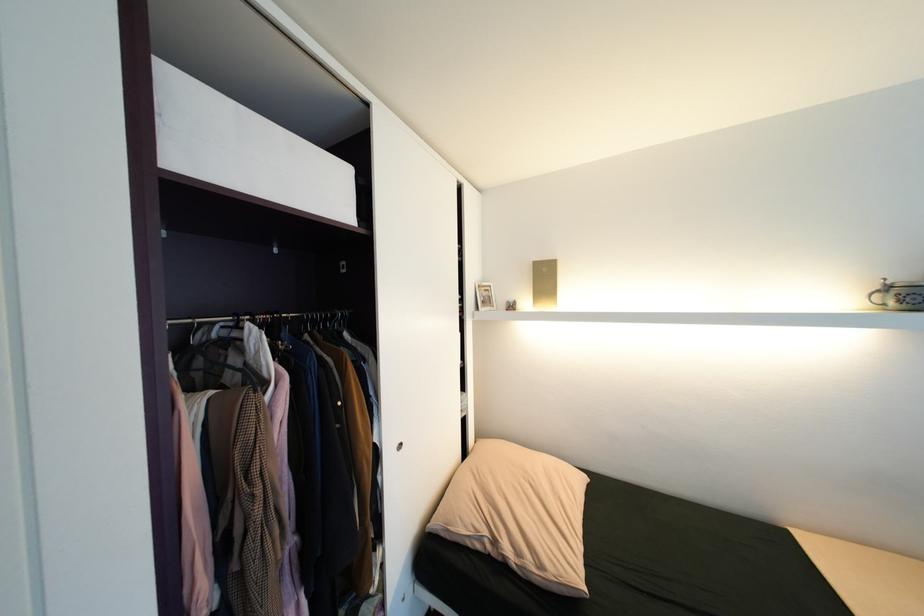
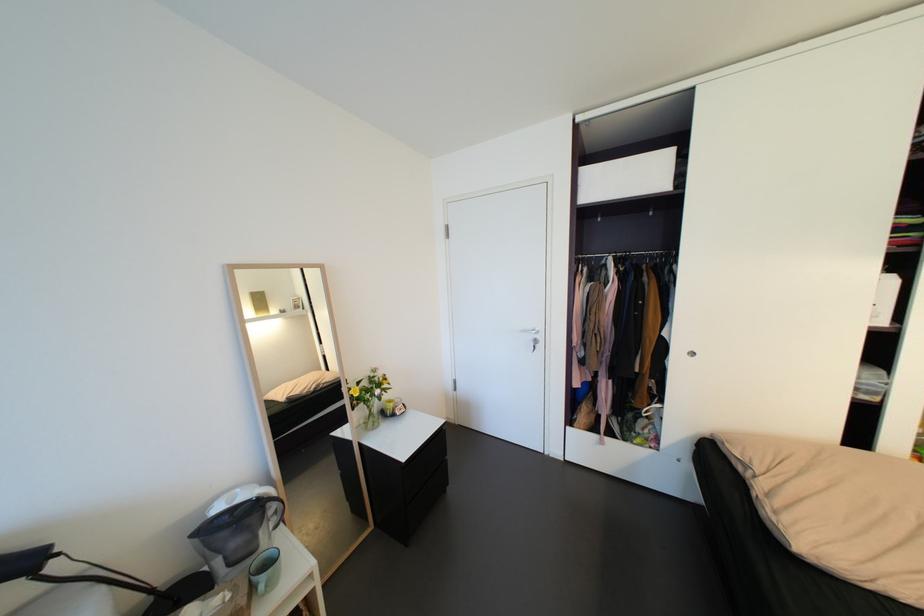
The point at (332, 325) is marked in the first image. Where is the corresponding point in the second image?

(667, 261)